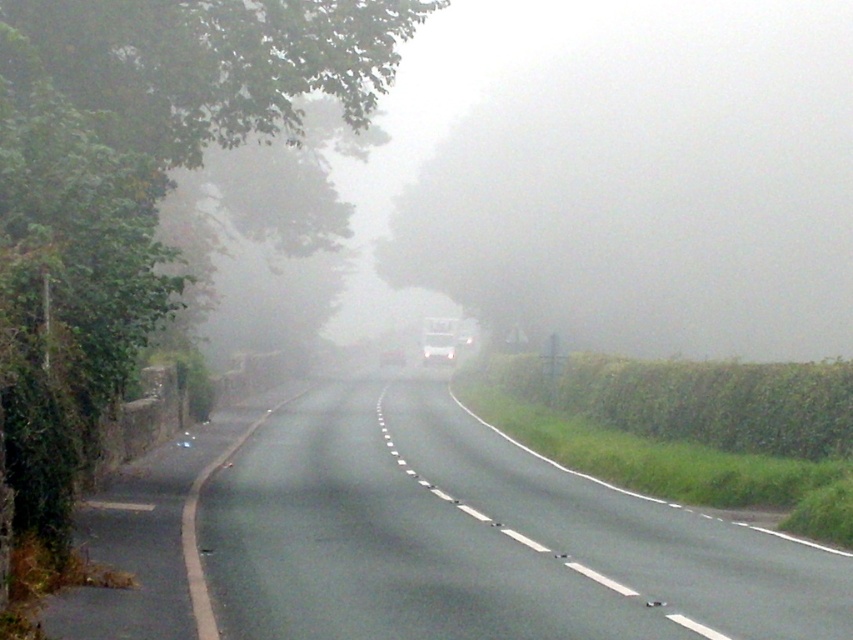
You are driving a car with a 5.5 meter turning radius. You need to make a U turn on the smooth asphalt road at center. Can you do it?

The smooth asphalt road at center is 6.86 meters away from camera, so the distance is sufficient for a U turn with a 5.5 meter turning radius.

You are driving a car and see the smooth asphalt road at center and the black asphalt road at left. Which road should you follow to stay on the correct path?

You should follow the smooth asphalt road at center because it is positioned to the right of the black asphalt road at left, indicating it is the main road continuing forward.